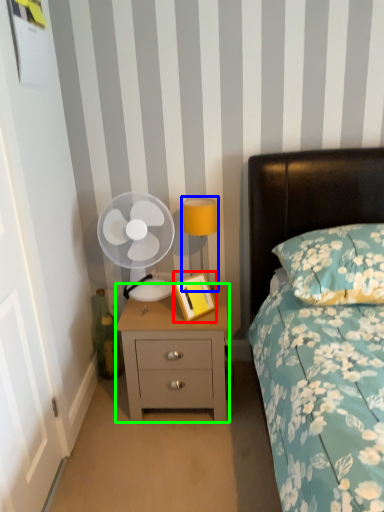
Question: Based on their relative distances, which object is nearer to picture frame (highlighted by a red box)? Choose from bedside lamp (highlighted by a blue box) and nightstand (highlighted by a green box).

Choices:
 (A) bedside lamp
 (B) nightstand

Answer: (B)